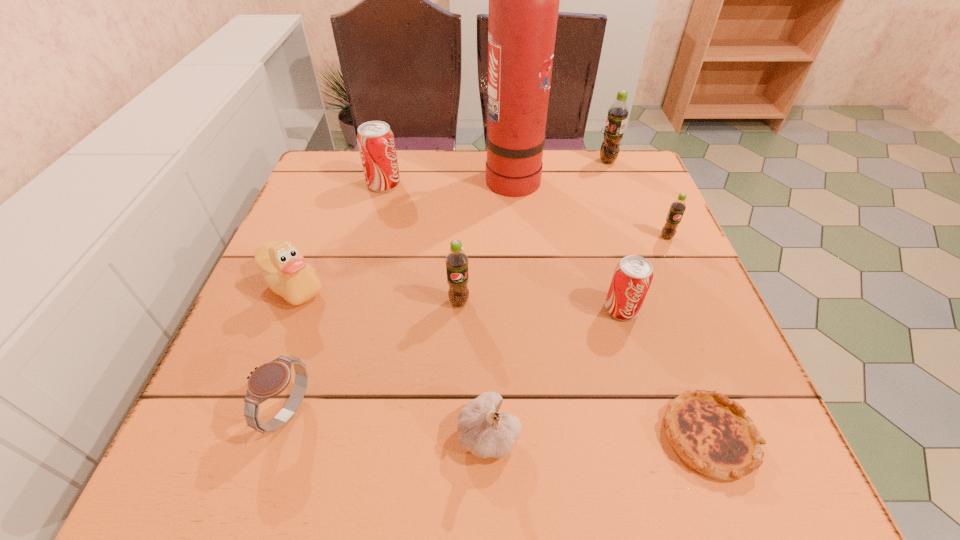
Image resolution: width=960 pixels, height=540 pixels. I want to click on fire extinguisher, so click(x=524, y=0).

I want to click on the second green soda from right to left, so (x=613, y=134).

You are a GUI agent. You are given a task and a screenshot of the screen. Output one action in this format:
    pyautogui.click(x=<x>, y=<y>)
    Task: Click on the farthest green soda
    The width and height of the screenshot is (960, 540).
    Given the screenshot: What is the action you would take?
    pyautogui.click(x=613, y=134)

Where is `the leftmost soda`? The width and height of the screenshot is (960, 540). the leftmost soda is located at coordinates tap(376, 144).

You are a GUI agent. You are given a task and a screenshot of the screen. Output one action in this format:
    pyautogui.click(x=<x>, y=<y>)
    Task: Click on the left red soda can
    
    Given the screenshot: What is the action you would take?
    pyautogui.click(x=376, y=144)

Where is `the second soda from left to right`? The width and height of the screenshot is (960, 540). the second soda from left to right is located at coordinates (456, 261).

Where is `the second biggest green soda`? This screenshot has width=960, height=540. the second biggest green soda is located at coordinates pyautogui.click(x=456, y=261).

Locate an element on the screen. This screenshot has height=540, width=960. duck is located at coordinates (282, 265).

In order to click on the right red soda can in this screenshot , I will do `click(633, 275)`.

Where is `the nearer red soda can`? The width and height of the screenshot is (960, 540). the nearer red soda can is located at coordinates (633, 275).